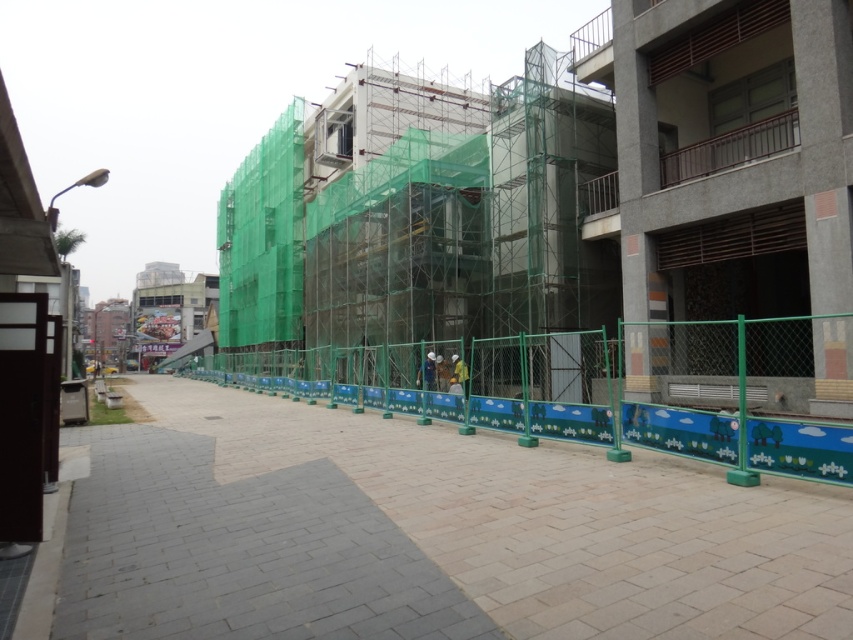
Question: Is green plastic fence at center to the left of yellow fabric construction worker at center from the viewer's perspective?

Choices:
 (A) no
 (B) yes

Answer: (B)

Question: Among these points, which one is farthest from the camera?

Choices:
 (A) (347, 285)
 (B) (465, 387)
 (C) (583, 438)
 (D) (276, 529)

Answer: (A)

Question: Can you confirm if brick pavement at center is positioned to the right of green plastic fence at center?

Choices:
 (A) yes
 (B) no

Answer: (B)

Question: Among these objects, which one is farthest from the camera?

Choices:
 (A) blue fabric construction worker at center
 (B) brick pavement at center
 (C) green plastic fence at center

Answer: (A)

Question: Which of these objects is positioned closest to the green plastic fence at center?

Choices:
 (A) green mesh scaffolding at center
 (B) blue fabric construction worker at center
 (C) yellow fabric construction worker at center
 (D) brick pavement at center

Answer: (C)

Question: Is green mesh scaffolding at center below blue fabric construction worker at center?

Choices:
 (A) no
 (B) yes

Answer: (A)